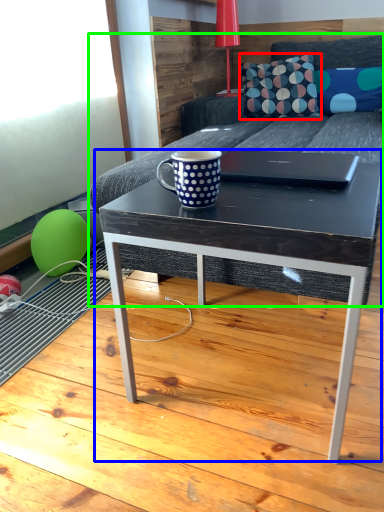
Question: Which object is positioned closest to throw pillow (highlighted by a red box)? Select from coffee table (highlighted by a blue box) and studio couch (highlighted by a green box).

Choices:
 (A) coffee table
 (B) studio couch

Answer: (B)